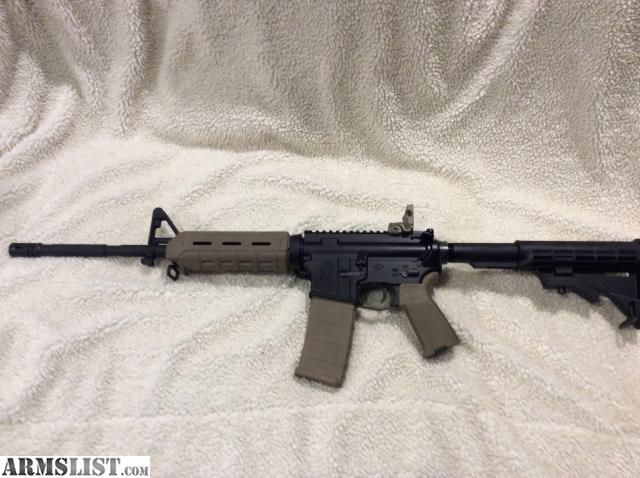
Where is `towel`? The image size is (640, 478). towel is located at coordinates (276, 151).